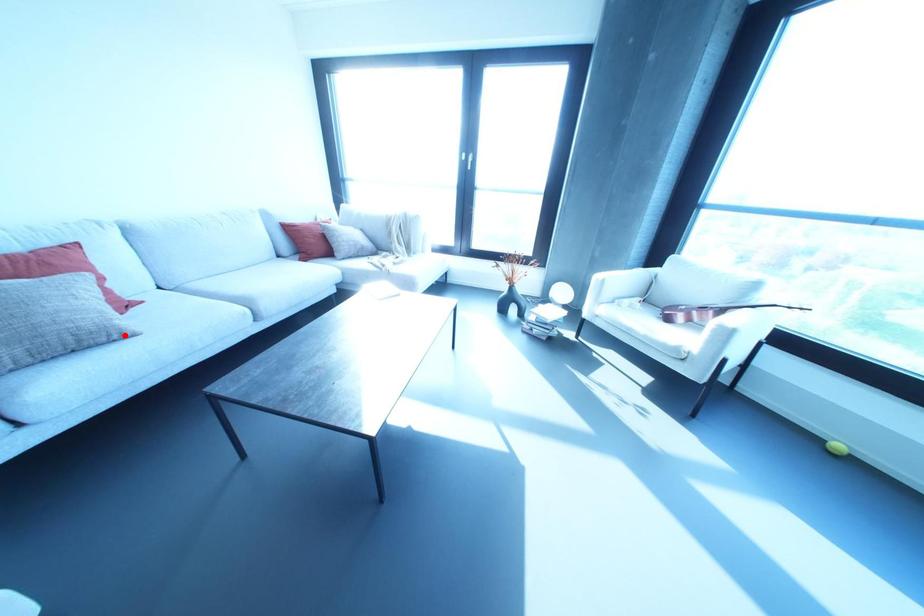
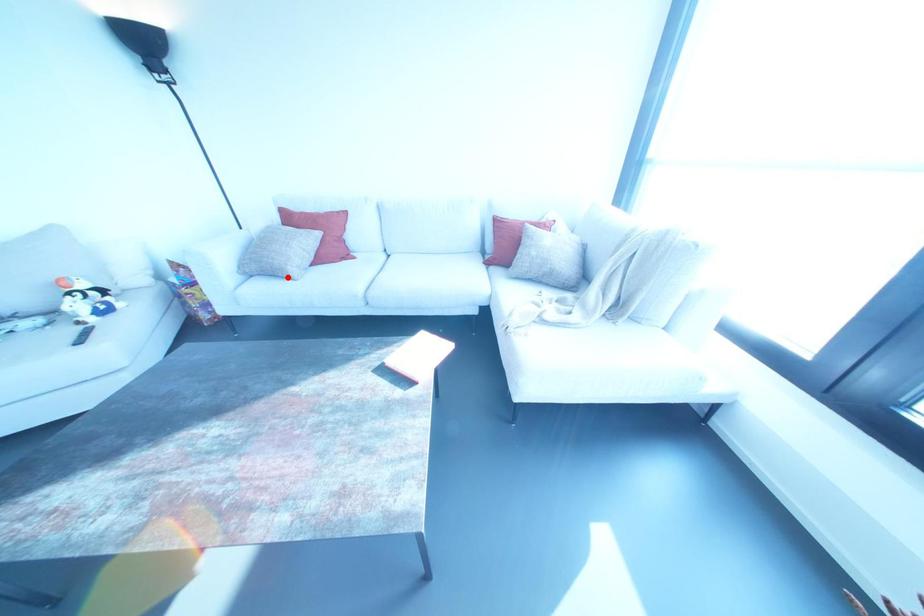
I am providing you with two images of the same scene from different viewpoints. A red point is marked on the first image and another point is marked on the second image. Is the red point in image1 aligned with the point shown in image2?

Yes